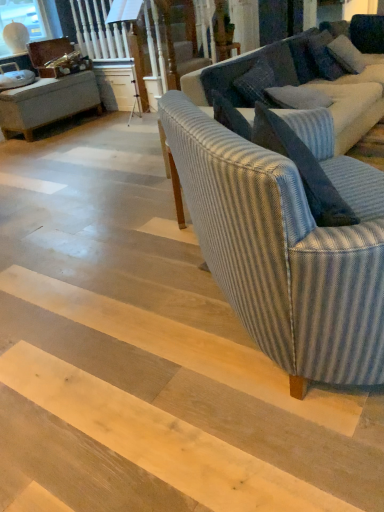
Question: From the image's perspective, is striped fabric couch at center, which ranks as the second studio couch in back-to-front order, located beneath blue striped pillow at upper right, acting as the 2th pillow starting from the back?

Choices:
 (A) no
 (B) yes

Answer: (B)

Question: Is striped fabric couch at center, arranged as the first studio couch when viewed from the front, looking in the opposite direction of blue striped pillow at upper right, acting as the 2th pillow starting from the back?

Choices:
 (A) no
 (B) yes

Answer: (A)

Question: Would you say striped fabric couch at center, which ranks as the second studio couch in back-to-front order, is outside blue striped pillow at upper right, acting as the 2th pillow starting from the top?

Choices:
 (A) no
 (B) yes

Answer: (B)

Question: Considering the relative positions of striped fabric couch at center, which ranks as the second studio couch in back-to-front order, and blue striped pillow at upper right, arranged as the second pillow when viewed from the right, in the image provided, is striped fabric couch at center, which ranks as the second studio couch in back-to-front order, to the right of blue striped pillow at upper right, arranged as the second pillow when viewed from the right, from the viewer's perspective?

Choices:
 (A) yes
 (B) no

Answer: (B)

Question: From a real-world perspective, is striped fabric couch at center, which ranks as the second studio couch in back-to-front order, on top of blue striped pillow at upper right, acting as the 2th pillow starting from the back?

Choices:
 (A) yes
 (B) no

Answer: (B)

Question: Considering the relative positions of striped fabric couch at center, which ranks as the second studio couch in back-to-front order, and blue striped pillow at upper right, which ranks as the first pillow in left-to-right order, in the image provided, is striped fabric couch at center, which ranks as the second studio couch in back-to-front order, to the left of blue striped pillow at upper right, which ranks as the first pillow in left-to-right order, from the viewer's perspective?

Choices:
 (A) yes
 (B) no

Answer: (A)

Question: Is striped fabric couch at center, arranged as the 2th studio couch when viewed from the front, not near striped fabric couch at center, arranged as the first studio couch when viewed from the front?

Choices:
 (A) yes
 (B) no

Answer: (A)

Question: Does striped fabric couch at center, arranged as the 2th studio couch when viewed from the front, have a lesser height compared to striped fabric couch at center, arranged as the first studio couch when viewed from the front?

Choices:
 (A) no
 (B) yes

Answer: (B)

Question: From the image's perspective, is striped fabric couch at center, placed as the 1th studio couch when sorted from back to front, beneath striped fabric couch at center, which ranks as the second studio couch in back-to-front order?

Choices:
 (A) no
 (B) yes

Answer: (A)

Question: From the image's perspective, is striped fabric couch at center, placed as the 1th studio couch when sorted from back to front, above striped fabric couch at center, which ranks as the second studio couch in back-to-front order?

Choices:
 (A) yes
 (B) no

Answer: (A)

Question: Is striped fabric couch at center, arranged as the 2th studio couch when viewed from the front, smaller than striped fabric couch at center, which ranks as the second studio couch in back-to-front order?

Choices:
 (A) yes
 (B) no

Answer: (B)

Question: Is striped fabric couch at center, placed as the 1th studio couch when sorted from back to front, bigger than striped fabric couch at center, which ranks as the second studio couch in back-to-front order?

Choices:
 (A) yes
 (B) no

Answer: (A)

Question: Is dark gray textured pillow at upper right, which is counted as the first pillow, starting from the back, smaller than striped fabric couch at center, placed as the 1th studio couch when sorted from back to front?

Choices:
 (A) yes
 (B) no

Answer: (A)